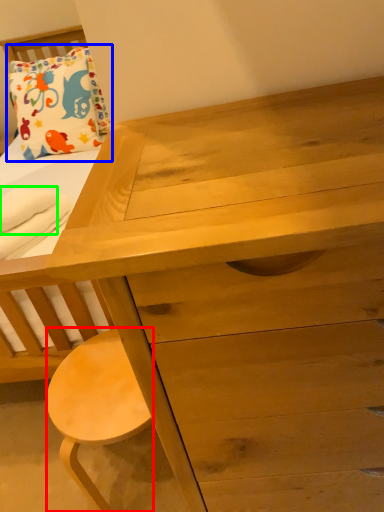
Question: Which object is the closest to the stool (highlighted by a red box)? Choose among these: pillow (highlighted by a blue box) or cloth (highlighted by a green box).

Choices:
 (A) pillow
 (B) cloth

Answer: (B)